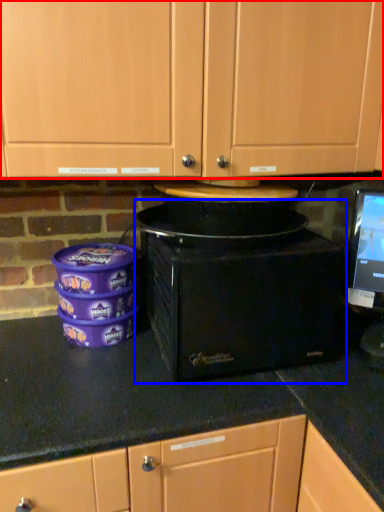
Question: Among these objects, which one is nearest to the camera, cabinetry (highlighted by a red box) or home appliance (highlighted by a blue box)?

Choices:
 (A) cabinetry
 (B) home appliance

Answer: (A)